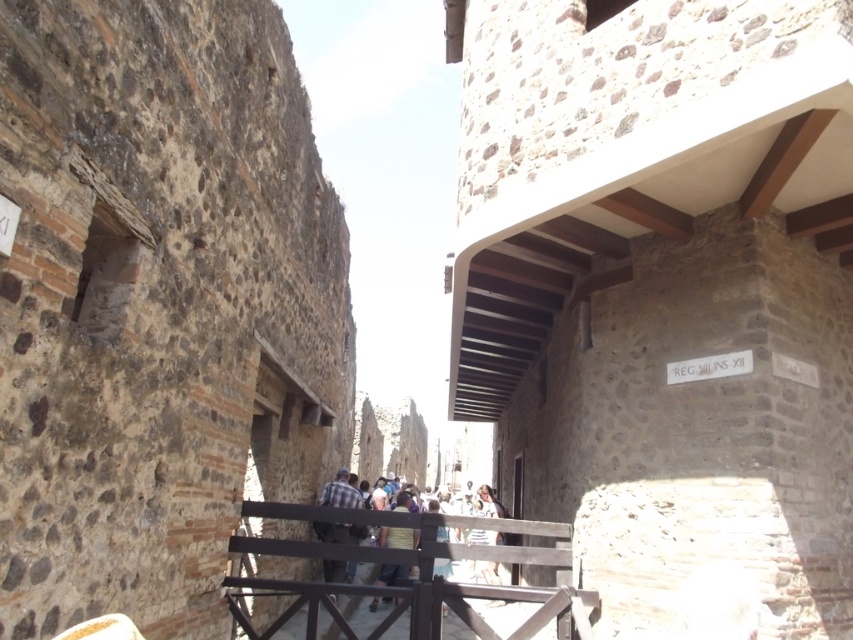
You are a tourist standing in the alleyway and see the black wood rail at center and the plaid shirt at center. Which object is closer to you?

The black wood rail at center is positioned over the plaid shirt at center, so the black wood rail at center is closer to you.

You are a painter standing in the alleyway between two stone walls. You notice a black wood rail at center and a plaid shirt at center. Which object is wider?

The black wood rail at center is wider than the plaid shirt at center.

You are standing in the alleyway and notice a black wood rail at center and a plaid shirt at center. Which object is positioned further to the right?

The black wood rail at center is to the right of the plaid shirt at center, so it is positioned further to the right.